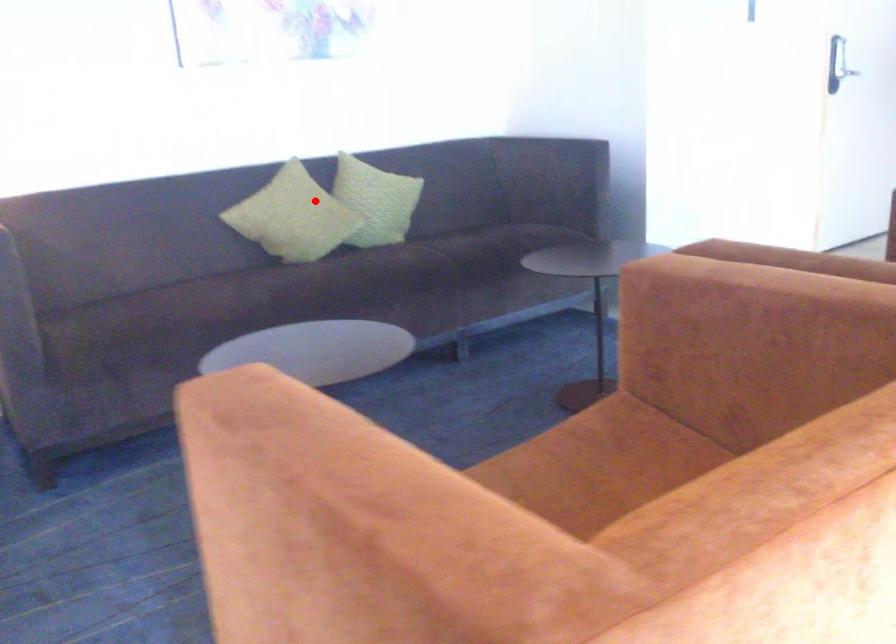
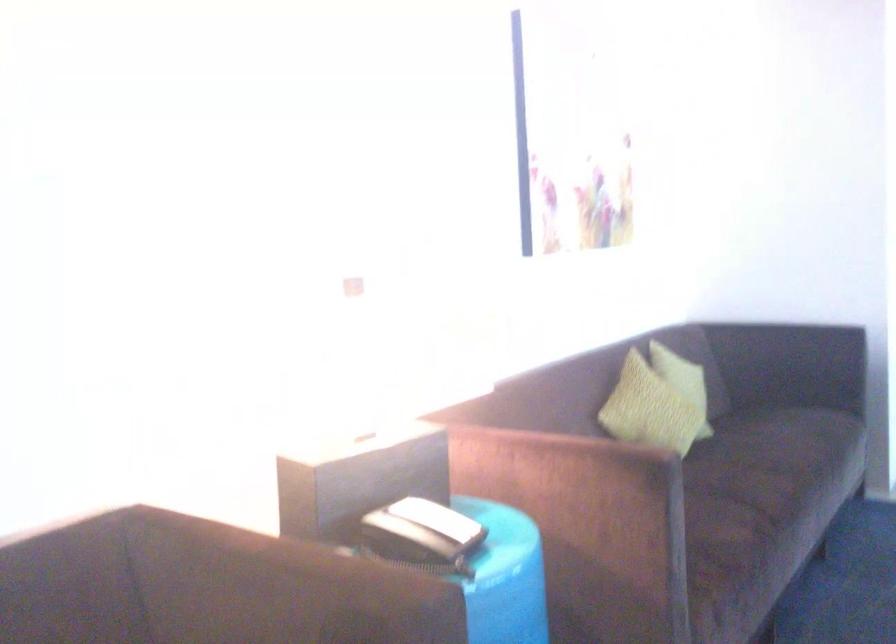
Question: I am providing you with two images of the same scene from different viewpoints. A red point is marked on the first image. Is the red point's position out of view in image 2?

Choices:
 (A) Yes
 (B) No

Answer: (B)